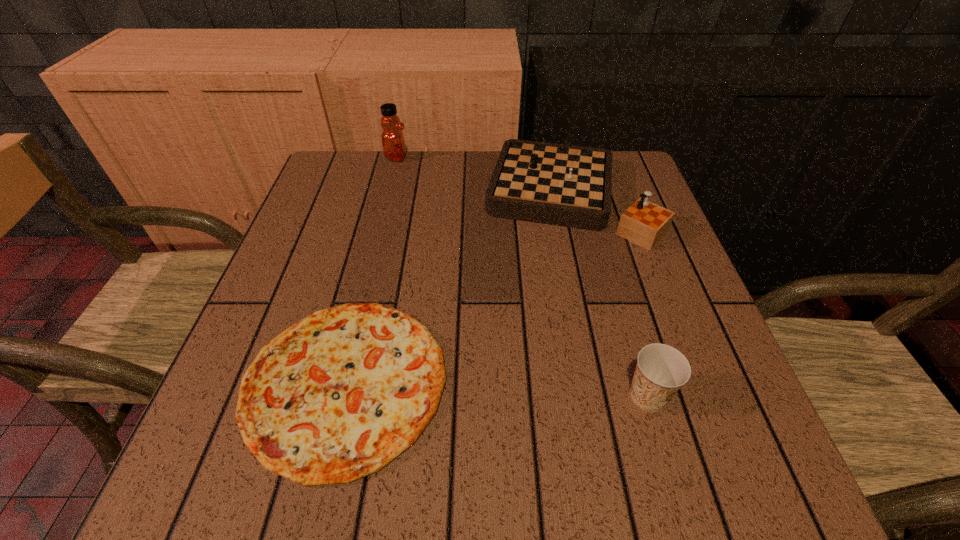
In order to click on vacant space that satisfies the following two spatial constraints: 1. on the front label of the tallest object; 2. on the left side of the chessboard in this screenshot , I will do `click(387, 197)`.

The height and width of the screenshot is (540, 960). I want to click on free spot that satisfies the following two spatial constraints: 1. on the front label of the Dixie cup; 2. on the right side of the honey, so click(338, 396).

You are a GUI agent. You are given a task and a screenshot of the screen. Output one action in this format:
    pyautogui.click(x=<x>, y=<y>)
    Task: Click on the free space that satisfies the following two spatial constraints: 1. on the front side of the shortest object; 2. on the right side of the Dixie cup
    This screenshot has height=540, width=960.
    Given the screenshot: What is the action you would take?
    pyautogui.click(x=342, y=396)